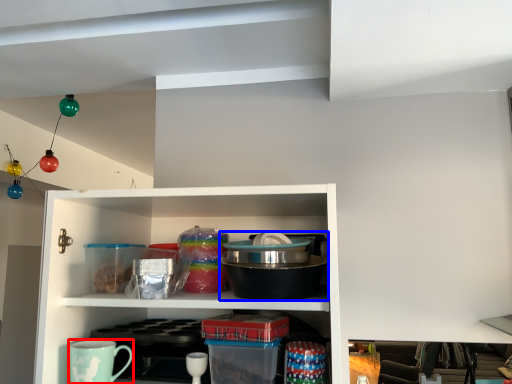
Question: Which object is further to the camera taking this photo, coffee cup (highlighted by a red box) or appliance (highlighted by a blue box)?

Choices:
 (A) coffee cup
 (B) appliance

Answer: (A)